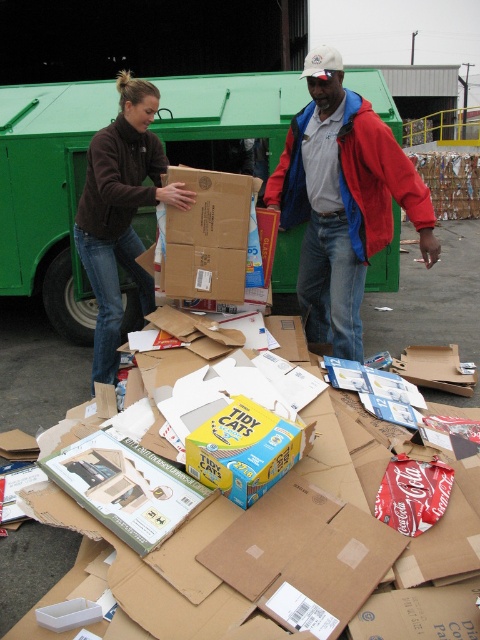
You are a delivery person who just arrived at the recycling area. You need to place a new package on the closest object to you. Which object should you choose between the red jacket at center and the matte brown cardboard box at center?

The red jacket at center is closer to the viewer than the matte brown cardboard box at center, so you should place the new package on the red jacket at center.

You are a delivery person trying to find a clear path to the green dumpster in the background. You see the red jacket at center and the matte brown cardboard box at center. Which object is taller and might block your view of the dumpster?

The red jacket at center is taller than the matte brown cardboard box at center, so it might block your view of the dumpster.

You are a delivery person who needs to place a new package on the pile of items. You have a box that is 1.2 meters wide. Looking at the dark brown fleece at center and the matte brown cardboard box at center, which one do you think your new box can fit next to without overlapping?

The dark brown fleece at center has a larger width than the matte brown cardboard box at center, so the 1.2 meter wide box would fit better next to the dark brown fleece at center.